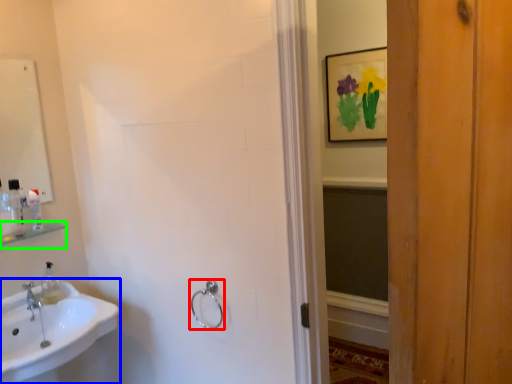
Question: Based on their relative distances, which object is nearer to towel rack (highlighted by a red box)? Choose from sink (highlighted by a blue box) and shelf (highlighted by a green box).

Choices:
 (A) sink
 (B) shelf

Answer: (A)